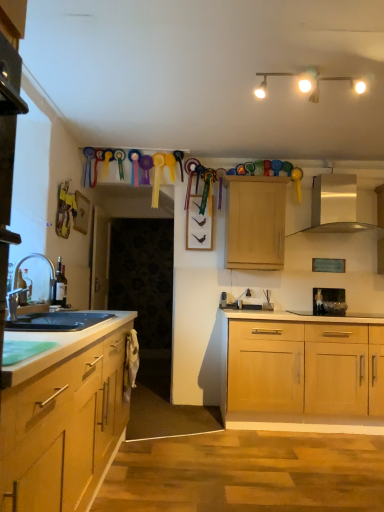
Question: Is black granite countertop at lower left bigger or smaller than silver metallic faucet at left?

Choices:
 (A) small
 (B) big

Answer: (B)

Question: From the image's perspective, relative to silver metallic faucet at left, is black granite countertop at lower left above or below?

Choices:
 (A) above
 (B) below

Answer: (B)

Question: Based on their relative distances, which object is nearer to the white matte track lights at upper center?

Choices:
 (A) silver metallic exhaust hood at upper center
 (B) silver metallic faucet at left
 (C) black granite countertop at lower left
 (D) metallic stainless steel microwave at right
 (E) light wood cabinet at upper center

Answer: (E)

Question: Based on their relative distances, which object is farther from the light wood cabinet at upper center?

Choices:
 (A) black glass gas stove at center
 (B) silver metallic faucet at left
 (C) white matte track lights at upper center
 (D) silver metallic exhaust hood at upper center
 (E) black granite countertop at lower left

Answer: (B)